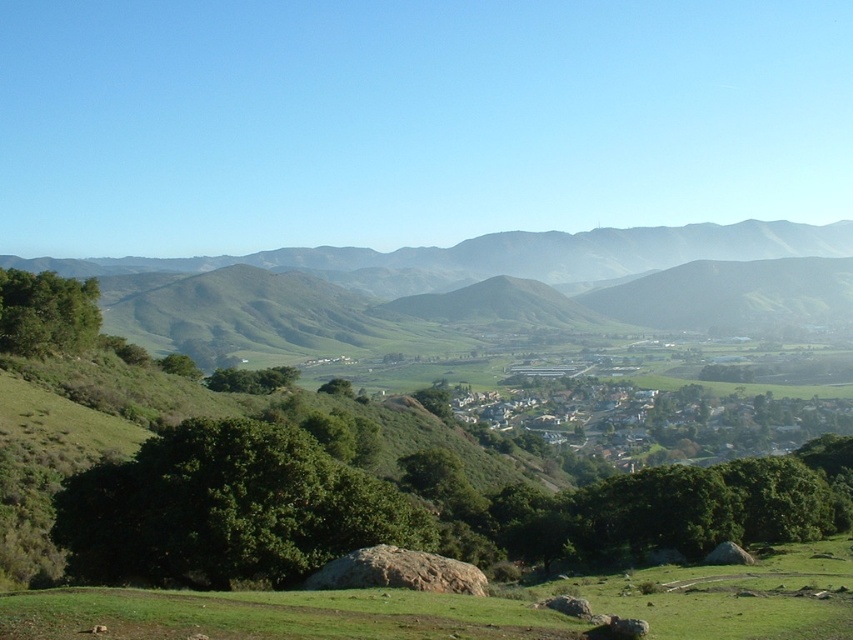
Question: Which of the following is the closest to the observer?

Choices:
 (A) (521, 232)
 (B) (627, 580)

Answer: (B)

Question: Considering the relative positions of green grassy hillside at center and green grassy field at lower center in the image provided, where is green grassy hillside at center located with respect to green grassy field at lower center?

Choices:
 (A) below
 (B) above

Answer: (B)

Question: Is green grassy hillside at center to the left of green grassy field at lower center from the viewer's perspective?

Choices:
 (A) no
 (B) yes

Answer: (A)

Question: Is green grassy hillside at center behind green grassy field at lower center?

Choices:
 (A) no
 (B) yes

Answer: (B)